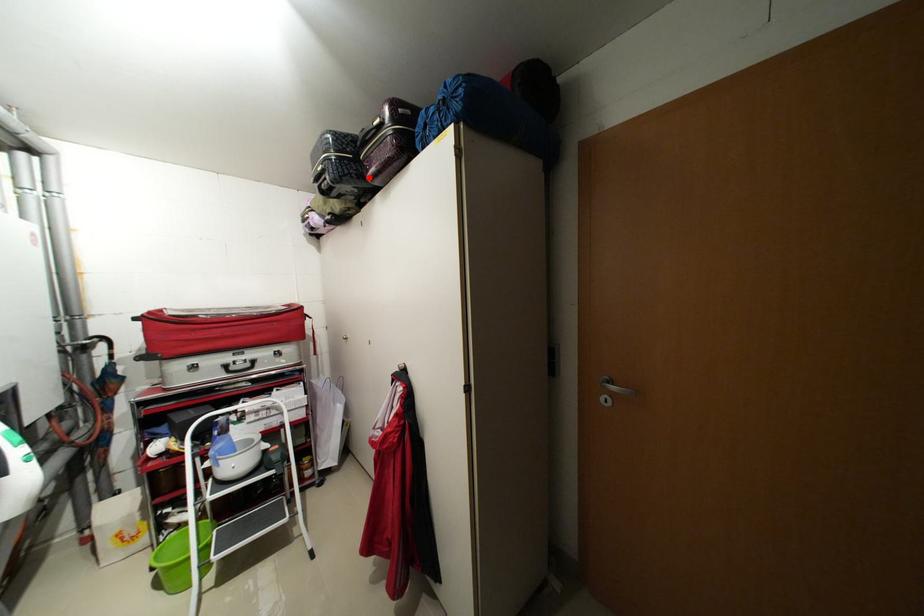
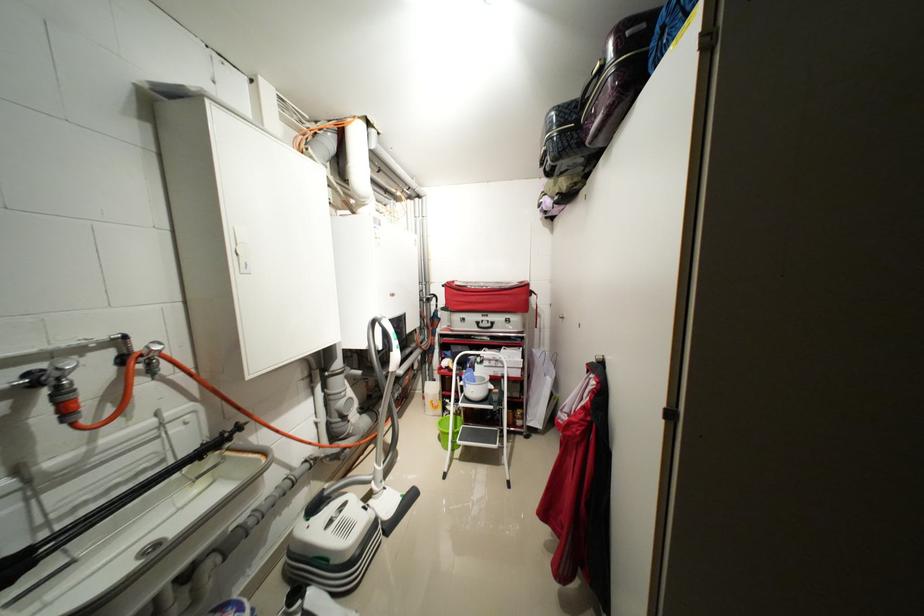
The point at the highlighted location is marked in the first image. Where is the corresponding point in the second image?

(589, 145)